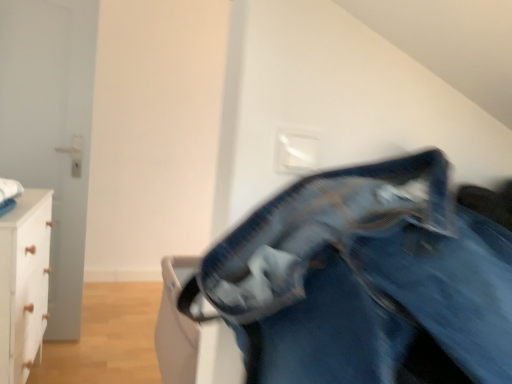
Question: Is denim pants at center outside of white matte chest of drawers at left?

Choices:
 (A) yes
 (B) no

Answer: (A)

Question: Can you confirm if denim pants at center is smaller than white matte chest of drawers at left?

Choices:
 (A) no
 (B) yes

Answer: (B)

Question: Considering the relative sizes of denim pants at center and white matte chest of drawers at left in the image provided, is denim pants at center wider than white matte chest of drawers at left?

Choices:
 (A) yes
 (B) no

Answer: (A)

Question: Can you confirm if denim pants at center is taller than white matte chest of drawers at left?

Choices:
 (A) no
 (B) yes

Answer: (A)

Question: Can you confirm if denim pants at center is shorter than white matte chest of drawers at left?

Choices:
 (A) no
 (B) yes

Answer: (B)

Question: Considering the relative positions of denim pants at center and white matte chest of drawers at left in the image provided, is denim pants at center behind white matte chest of drawers at left?

Choices:
 (A) yes
 (B) no

Answer: (B)

Question: Does white matte chest of drawers at left have a lesser width compared to denim pants at center?

Choices:
 (A) yes
 (B) no

Answer: (A)

Question: Could you tell me if white matte chest of drawers at left is facing denim pants at center?

Choices:
 (A) yes
 (B) no

Answer: (B)

Question: Is white matte chest of drawers at left positioned with its back to denim pants at center?

Choices:
 (A) yes
 (B) no

Answer: (B)

Question: From a real-world perspective, is white matte chest of drawers at left positioned over denim pants at center based on gravity?

Choices:
 (A) yes
 (B) no

Answer: (B)

Question: Is white matte chest of drawers at left bigger than denim pants at center?

Choices:
 (A) yes
 (B) no

Answer: (A)

Question: From the image's perspective, is white matte chest of drawers at left beneath denim pants at center?

Choices:
 (A) no
 (B) yes

Answer: (B)

Question: From a real-world perspective, is denim pants at center positioned above or below white matte chest of drawers at left?

Choices:
 (A) below
 (B) above

Answer: (B)